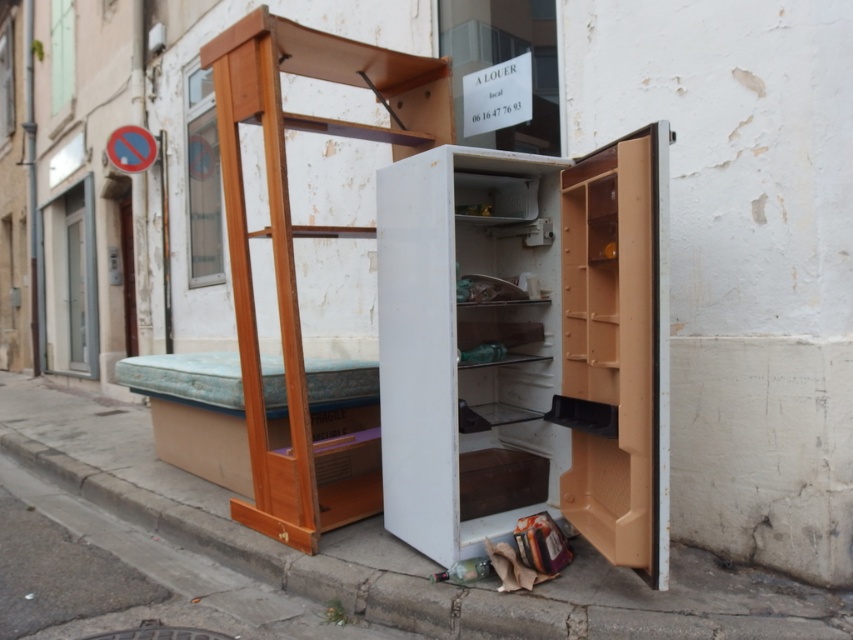
You are standing on the wooden ladder at left and need to step down onto the white concrete pavement at lower center. Is the pavement to your left or right side?

The white concrete pavement at lower center is to the left of the wooden ladder at left, so when standing on the wooden ladder at left, the pavement is on your left side.

You are a delivery person trying to place a large package on the wooden ladder at left. The package is taller than the white plastic refrigerator at center. Can you safely place the package on the ladder without it hitting the refrigerator?

The white plastic refrigerator at center is positioned under the wooden ladder at left, so placing a package taller than the refrigerator on the ladder may cause it to hit the refrigerator below. You should check the height clearance between the ladder and the refrigerator before placing the package.

You are a delivery person trying to move a large box through the street. The box is as tall as the white concrete pavement at lower center. Can you pass under the white plastic refrigerator at center without hitting the box on it?

The white plastic refrigerator at center is much taller than the white concrete pavement at lower center. Since the box is as tall as the pavement, it should be shorter than the refrigerator. Therefore, you can pass under the white plastic refrigerator at center without hitting the box on it.